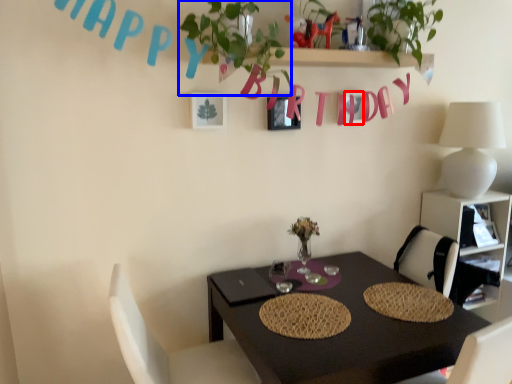
Question: Which of the following is the farthest to the observer, alphabet (highlighted by a red box) or plant (highlighted by a blue box)?

Choices:
 (A) alphabet
 (B) plant

Answer: (A)